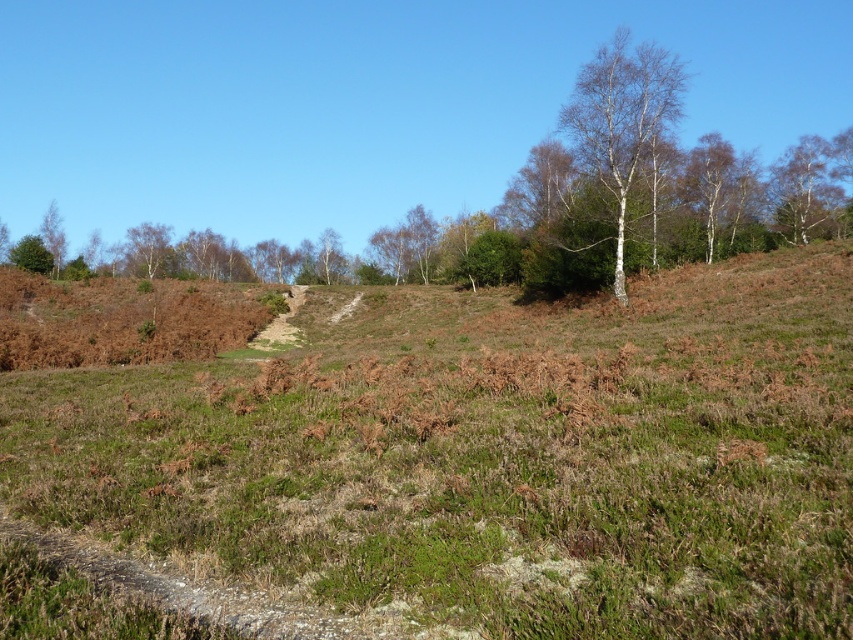
You are an explorer navigating through the landscape and want to locate the white bark tree at upper right and the white smooth tree at upper right. According to the scene, which tree is positioned more to the left?

The white bark tree at upper right is positioned to the left of the white smooth tree at upper right, so the white bark tree at upper right is more to the left.

You are a hiker standing on the narrow dirt path in the midground. You notice the green grassy at center and the white smooth tree at upper right. Which object is located to the left of the other?

The green grassy at center is positioned on the left side of white smooth tree at upper right.